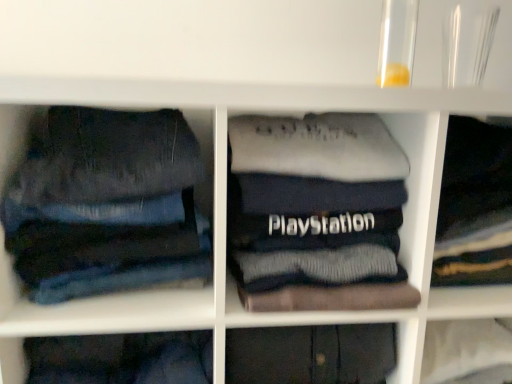
Question: Can you confirm if denim jeans at left is smaller than dark blue cotton sweatshirt at center, the second clothing from the right?

Choices:
 (A) yes
 (B) no

Answer: (A)

Question: Can you confirm if denim jeans at left is positioned to the left of dark blue cotton sweatshirt at center, which ranks as the first clothing in left-to-right order?

Choices:
 (A) no
 (B) yes

Answer: (B)

Question: Does denim jeans at left have a larger size compared to dark blue cotton sweatshirt at center, the second clothing from the right?

Choices:
 (A) yes
 (B) no

Answer: (B)

Question: Is denim jeans at left turned away from dark blue cotton sweatshirt at center, which ranks as the first clothing in left-to-right order?

Choices:
 (A) no
 (B) yes

Answer: (A)

Question: Is denim jeans at left wider than dark blue cotton sweatshirt at center, the second clothing from the right?

Choices:
 (A) yes
 (B) no

Answer: (B)

Question: Does denim jeans at left appear on the right side of dark blue cotton sweatshirt at center, the second clothing from the right?

Choices:
 (A) yes
 (B) no

Answer: (B)

Question: Does dark blue cotton sweatshirt at center, which ranks as the first clothing in left-to-right order, have a greater width compared to denim jeans at left?

Choices:
 (A) yes
 (B) no

Answer: (A)

Question: Considering the relative positions of dark blue cotton sweatshirt at center, the second clothing from the right, and denim jeans at left in the image provided, is dark blue cotton sweatshirt at center, the second clothing from the right, in front of denim jeans at left?

Choices:
 (A) no
 (B) yes

Answer: (A)

Question: Is dark blue cotton sweatshirt at center, which ranks as the first clothing in left-to-right order, taller than denim jeans at left?

Choices:
 (A) yes
 (B) no

Answer: (B)

Question: Can you confirm if dark blue cotton sweatshirt at center, which ranks as the first clothing in left-to-right order, is positioned to the left of denim jeans at left?

Choices:
 (A) yes
 (B) no

Answer: (B)

Question: From the image's perspective, is dark blue cotton sweatshirt at center, which ranks as the first clothing in left-to-right order, beneath denim jeans at left?

Choices:
 (A) yes
 (B) no

Answer: (A)

Question: Can you confirm if dark blue cotton sweatshirt at center, the second clothing from the right, is shorter than denim jeans at left?

Choices:
 (A) yes
 (B) no

Answer: (A)

Question: From the image's perspective, is dark gray sweater at center, the second clothing from the left, on top of dark blue cotton sweatshirt at center, the second clothing from the right?

Choices:
 (A) yes
 (B) no

Answer: (A)